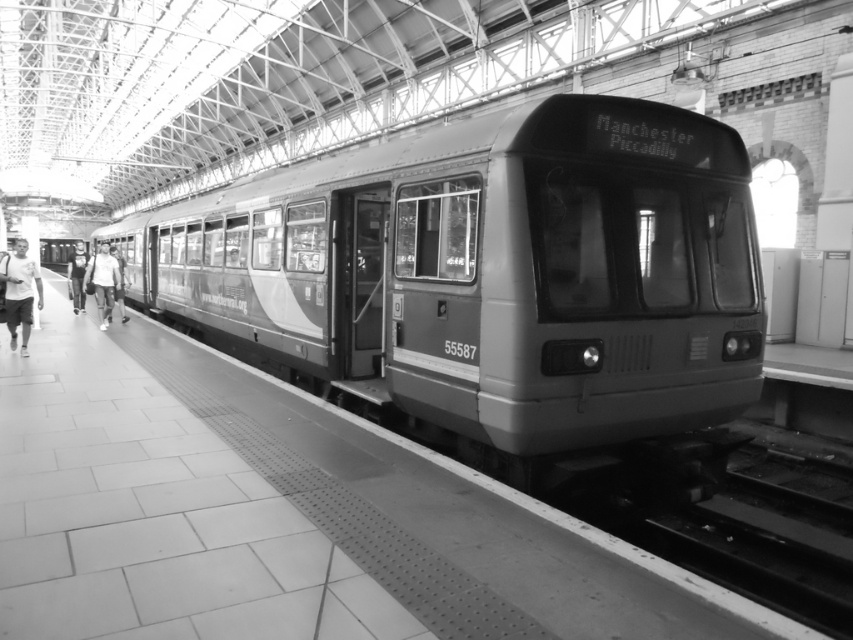
Is point (466, 214) positioned in front of point (74, 248)?

That is True.

Image resolution: width=853 pixels, height=640 pixels. What do you see at coordinates (492, 273) in the screenshot?
I see `metallic gray train at center` at bounding box center [492, 273].

Between point (480, 376) and point (78, 298), which one is positioned in front?

Positioned in front is point (480, 376).

Identify the location of metallic gray train at center. Image resolution: width=853 pixels, height=640 pixels. (492, 273).

Is point (20, 273) positioned after point (107, 273)?

No.

Find the location of a particular element. The image size is (853, 640). light gray shirt at left is located at coordinates (19, 292).

Does light gray shirt at left appear under denim jacket at center?

Indeed, light gray shirt at left is positioned under denim jacket at center.

Does light gray shirt at left have a greater height compared to denim jacket at center?

No.

Who is more distant from viewer, [13,348] or [68,256]?

Point [68,256]

Locate an element on the screen. The height and width of the screenshot is (640, 853). light gray shirt at left is located at coordinates (19, 292).